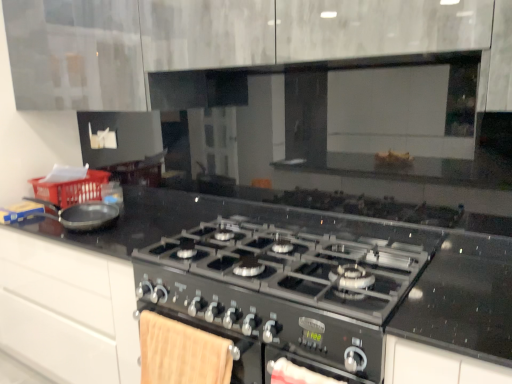
Question: Can we say matte black frying pan at left lies outside red plastic basket at left?

Choices:
 (A) no
 (B) yes

Answer: (B)

Question: Is the position of matte black frying pan at left less distant than that of red plastic basket at left?

Choices:
 (A) yes
 (B) no

Answer: (A)

Question: From a real-world perspective, is matte black frying pan at left beneath red plastic basket at left?

Choices:
 (A) no
 (B) yes

Answer: (A)

Question: Can you confirm if matte black frying pan at left is shorter than red plastic basket at left?

Choices:
 (A) yes
 (B) no

Answer: (A)

Question: Does matte black frying pan at left have a smaller size compared to red plastic basket at left?

Choices:
 (A) no
 (B) yes

Answer: (B)

Question: From the image's perspective, is matte black frying pan at left over red plastic basket at left?

Choices:
 (A) yes
 (B) no

Answer: (B)

Question: Is black metallic gas stove at center located within matte black frying pan at left?

Choices:
 (A) yes
 (B) no

Answer: (B)

Question: Can you confirm if matte black frying pan at left is bigger than black metallic gas stove at center?

Choices:
 (A) no
 (B) yes

Answer: (A)

Question: Is matte black frying pan at left further to camera compared to black metallic gas stove at center?

Choices:
 (A) yes
 (B) no

Answer: (A)

Question: From a real-world perspective, is matte black frying pan at left below black metallic gas stove at center?

Choices:
 (A) yes
 (B) no

Answer: (B)

Question: Are matte black frying pan at left and black metallic gas stove at center making contact?

Choices:
 (A) yes
 (B) no

Answer: (B)

Question: Can we say matte black frying pan at left lies outside black metallic gas stove at center?

Choices:
 (A) yes
 (B) no

Answer: (A)

Question: Considering the relative positions of black metallic gas stove at center and matte black frying pan at left in the image provided, is black metallic gas stove at center in front of matte black frying pan at left?

Choices:
 (A) no
 (B) yes

Answer: (B)